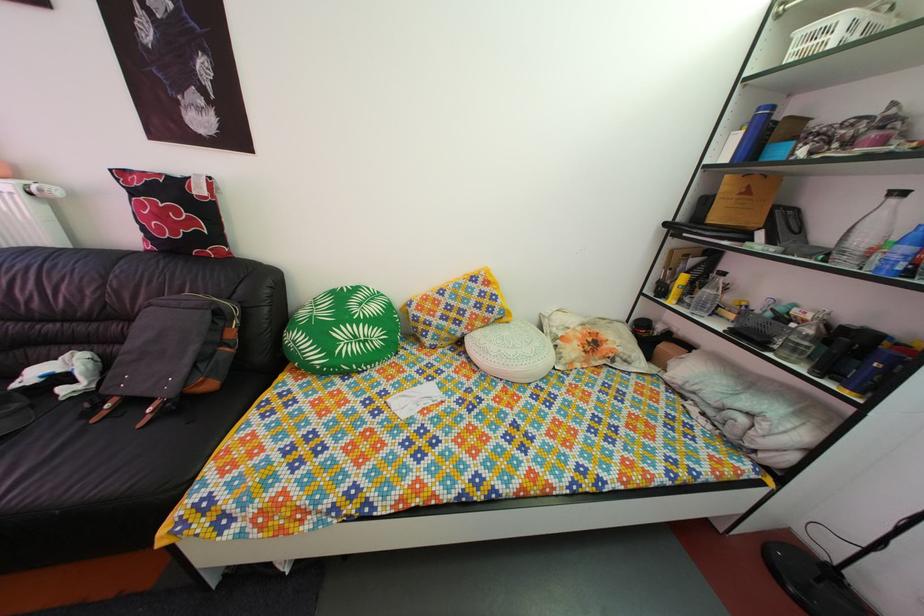
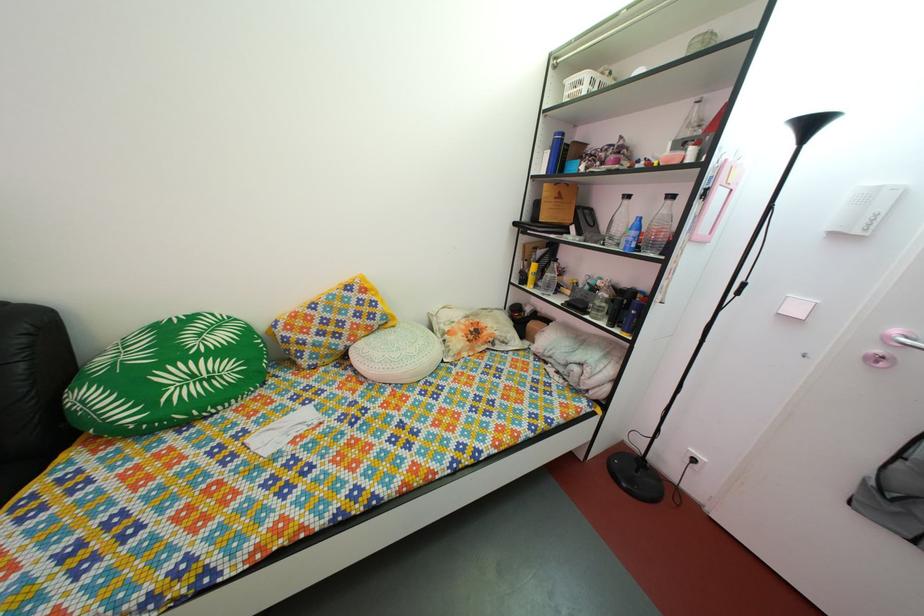
In the second image, find the point that corresponds to the point at 468,342 in the first image.

(349, 357)